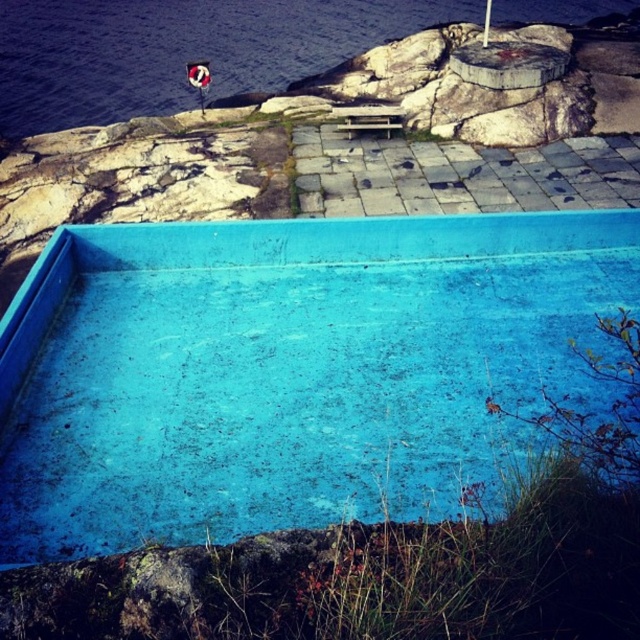
Measure the distance between blue matte pool at center and camera.

A distance of 10.78 feet exists between blue matte pool at center and camera.

Is blue matte pool at center thinner than blue concrete water at upper left?

Yes.

Does point (477, 260) come closer to viewer compared to point (236, 49)?

That is True.

Identify the location of blue matte pool at center. The width and height of the screenshot is (640, 640). (285, 369).